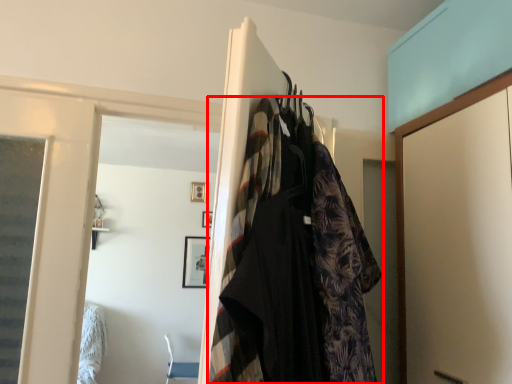
Question: Observing the image, what is the correct spatial positioning of fancy dress (annotated by the red box) in reference to clothing?

Choices:
 (A) left
 (B) right

Answer: (A)